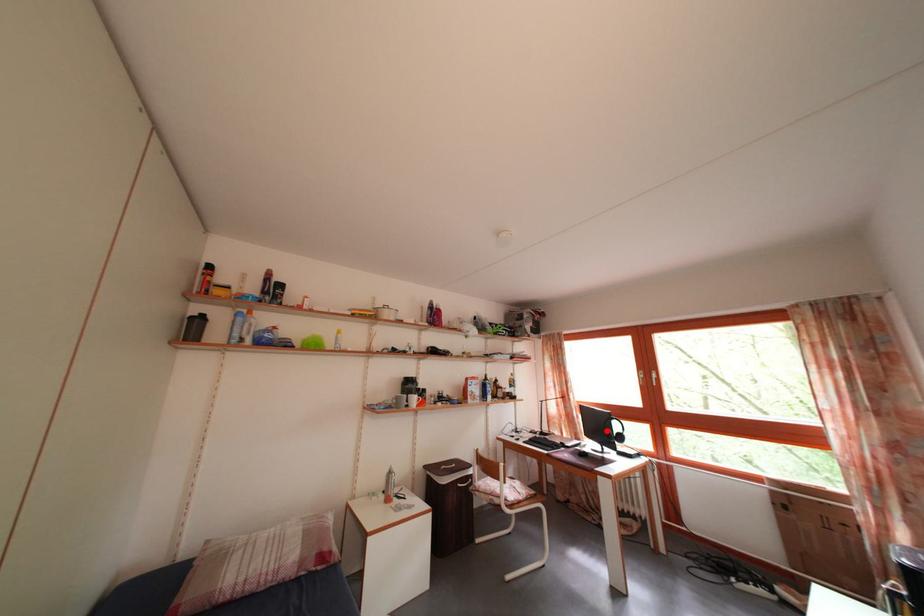
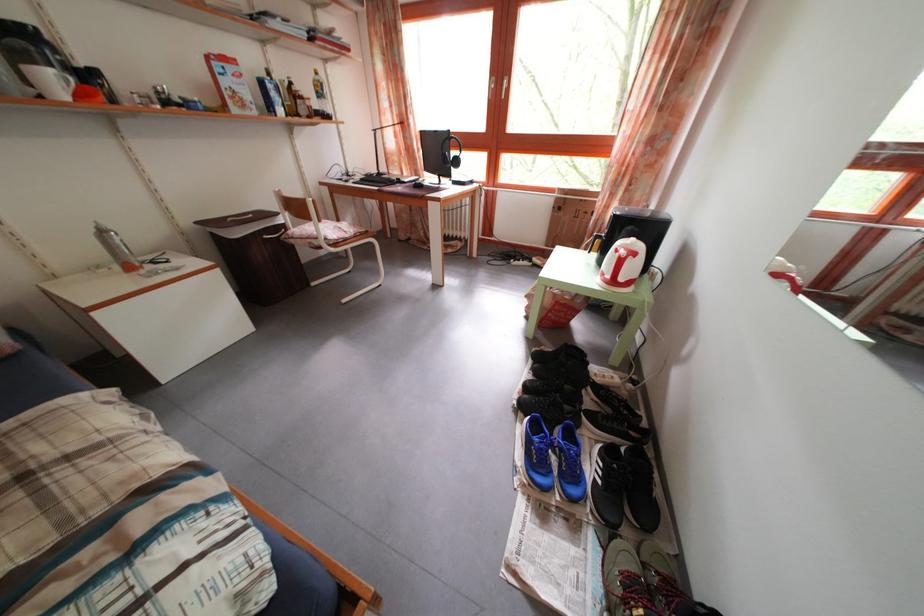
Locate, in the second image, the point that corresponds to the highlighted location in the first image.

(446, 160)